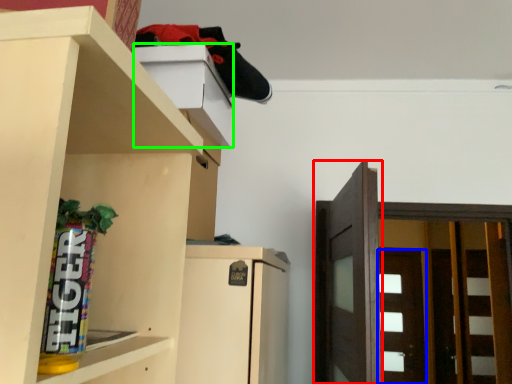
Question: Considering the real-world distances, which object is closest to door (highlighted by a red box)? door (highlighted by a blue box) or cabinet (highlighted by a green box).

Choices:
 (A) door
 (B) cabinet

Answer: (B)